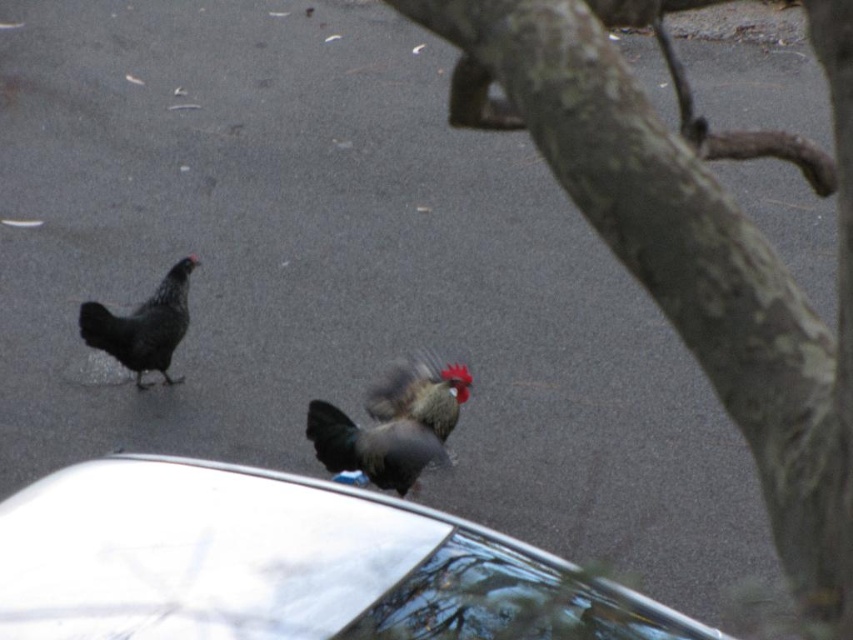
Between transparent glass car window at lower center and shiny brown rooster at center, which one is positioned higher?

shiny brown rooster at center

Between transparent glass car window at lower center and shiny brown rooster at center, which one is positioned lower?

transparent glass car window at lower center is below.

Between point (560, 637) and point (451, 376), which one is positioned in front?

Point (560, 637) is more forward.

Find the location of `transparent glass car window at lower center`. transparent glass car window at lower center is located at coordinates (512, 600).

Can you confirm if shiny brown rooster at center is thinner than black matte chicken at left?

In fact, shiny brown rooster at center might be wider than black matte chicken at left.

Is shiny brown rooster at center below black matte chicken at left?

Yes.

Does point (352, 433) come behind point (120, 349)?

That is False.

The width and height of the screenshot is (853, 640). I want to click on shiny brown rooster at center, so click(x=393, y=424).

Can you confirm if white glossy car at lower left is positioned to the left of transparent glass car window at lower center?

Indeed, white glossy car at lower left is positioned on the left side of transparent glass car window at lower center.

Is white glossy car at lower left wider than transparent glass car window at lower center?

Correct, the width of white glossy car at lower left exceeds that of transparent glass car window at lower center.

Who is more distant from viewer, [248,636] or [601,580]?

Positioned behind is point [601,580].

Identify the location of white glossy car at lower left. (281, 564).